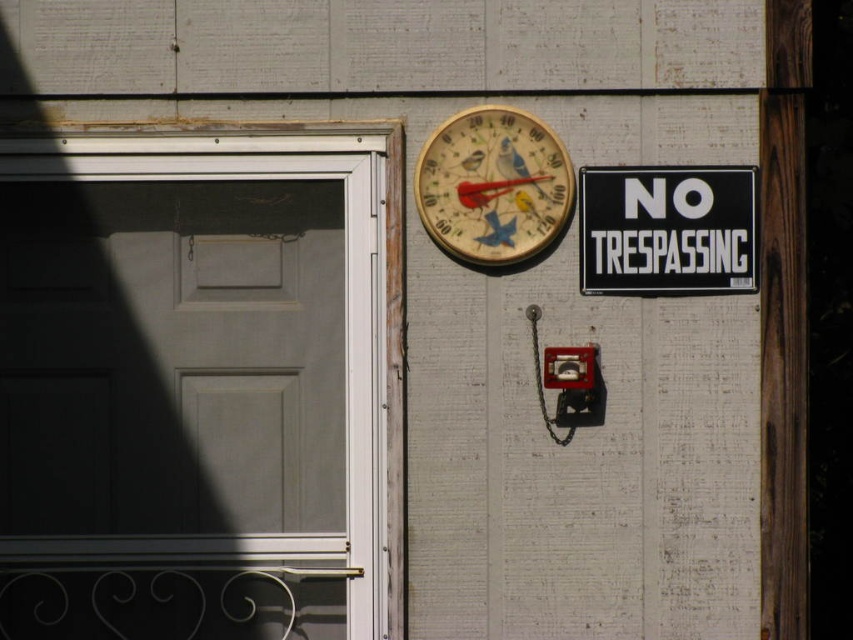
Question: Among these points, which one is farthest from the camera?

Choices:
 (A) (509, 252)
 (B) (724, 250)
 (C) (373, 442)

Answer: (B)

Question: Is matte gray door at left below wooden painted thermometer at upper center?

Choices:
 (A) no
 (B) yes

Answer: (B)

Question: Which point appears farthest from the camera in this image?

Choices:
 (A) (51, 452)
 (B) (677, 196)
 (C) (521, 220)

Answer: (A)

Question: Does matte gray door at left appear on the left side of black plastic sign at upper right?

Choices:
 (A) no
 (B) yes

Answer: (B)

Question: Is matte gray door at left further to camera compared to wooden painted thermometer at upper center?

Choices:
 (A) no
 (B) yes

Answer: (B)

Question: Estimate the real-world distances between objects in this image. Which object is farther from the matte gray door at left?

Choices:
 (A) wooden painted thermometer at upper center
 (B) black plastic sign at upper right

Answer: (B)